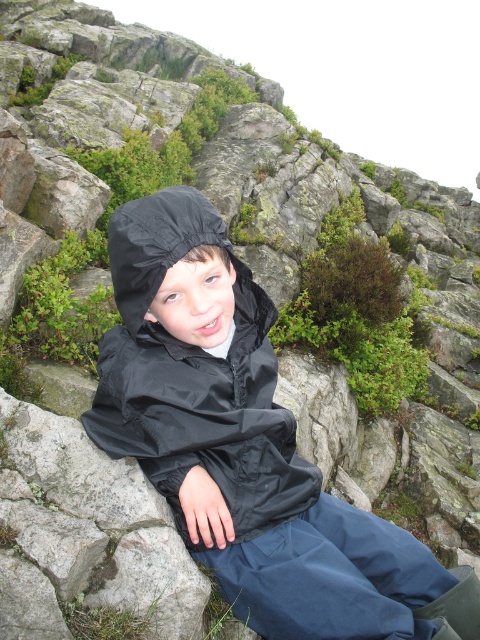
Consider the image. You are a hiker who wants to place a small backpack on the ground near the child. The backpack is 0.3 meters in width. The point where you want to place it is at coordinate point (240, 442). Is there enough space to place the backpack there without overlapping the black waterproof jacket at center?

The black waterproof jacket at center is located at point (240, 442). Since the backpack is 0.3 meters wide, there might not be enough space if the jacket occupies that exact point. You should check the surrounding area for more space.

You are a photographer trying to capture the child in the scene. You need to know which jacket is on the left to adjust your camera angle. Which jacket is positioned to the left between the black waterproof jacket at center and the black nylon jacket at center?

The black nylon jacket at center is positioned to the left of the black waterproof jacket at center.

You are a photographer trying to capture the child in the center of the image. The child is wearing a black waterproof jacket at center. Where should you focus your camera to ensure the jacket is sharply in focus?

You should focus your camera at point (240, 442) to ensure the black waterproof jacket at center is sharply in focus, as that is the position of the jacket.